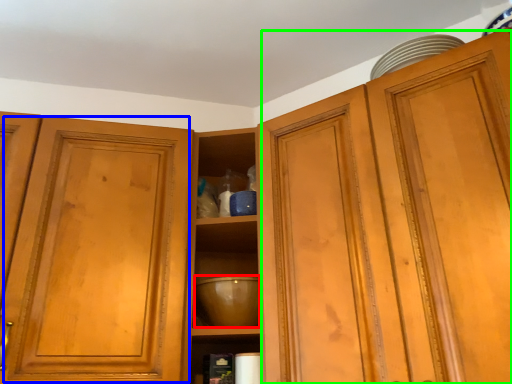
Question: Which object is positioned closest to mixing bowl (highlighted by a red box)? Select from glass door (highlighted by a blue box) and cabinetry (highlighted by a green box).

Choices:
 (A) glass door
 (B) cabinetry

Answer: (A)